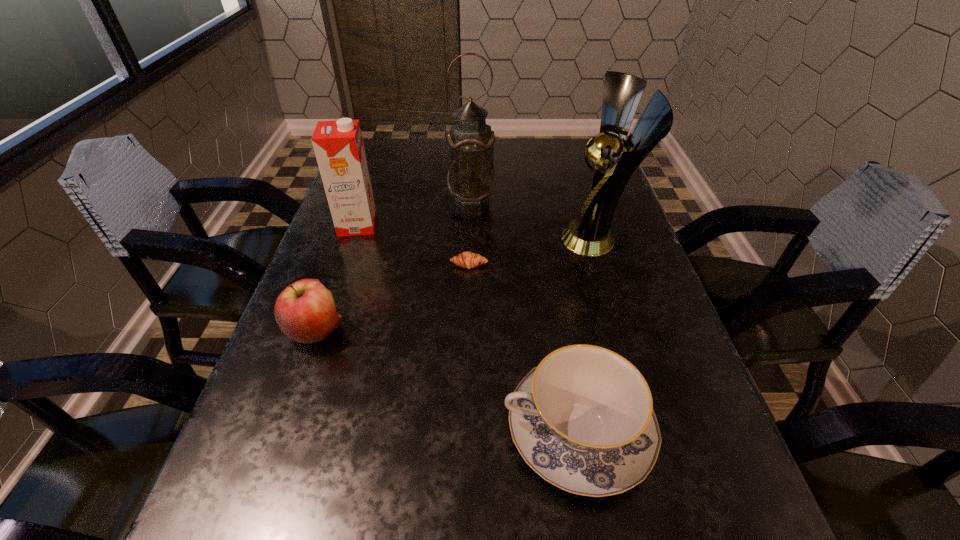
At what (x,y) coordinates should I click in order to perform the action: click on free space at the left edge of the desktop. Please return your answer as a coordinate pair (x, y). Looking at the image, I should click on (288, 518).

The image size is (960, 540). In the image, there is a desktop. Identify the location of vacant region at the right edge. (670, 415).

Where is `vacant space at the far right corner of the desktop`? This screenshot has height=540, width=960. vacant space at the far right corner of the desktop is located at coordinates (587, 138).

This screenshot has width=960, height=540. In order to click on free space between the apple and the pastry in this screenshot , I will do `click(393, 298)`.

The width and height of the screenshot is (960, 540). In order to click on empty location between the award and the carton in this screenshot , I will do click(478, 232).

Where is `free point between the chinaware and the apple`? free point between the chinaware and the apple is located at coordinates (446, 381).

Where is `free spot between the oil lamp and the nearest object`? The image size is (960, 540). free spot between the oil lamp and the nearest object is located at coordinates (524, 315).

The image size is (960, 540). In order to click on empty location between the second nearest object and the nearest object in this screenshot , I will do `click(446, 381)`.

At what (x,y) coordinates should I click in order to perform the action: click on unoccupied position between the oil lamp and the chinaware. Please return your answer as a coordinate pair (x, y). The width and height of the screenshot is (960, 540). Looking at the image, I should click on (524, 315).

The height and width of the screenshot is (540, 960). In order to click on free point between the nearest object and the third tallest object in this screenshot , I will do `click(468, 328)`.